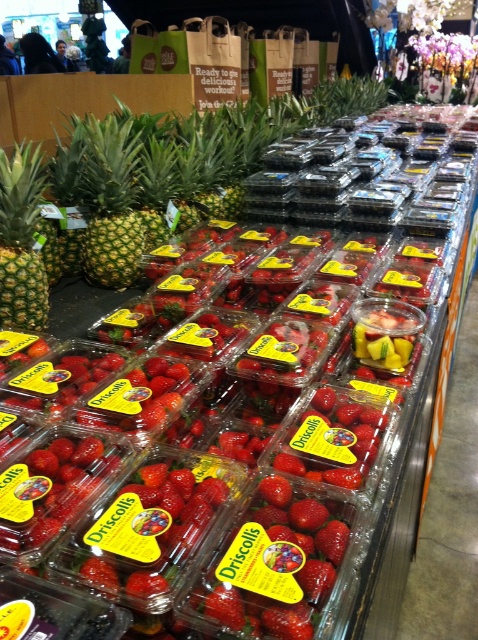
The height and width of the screenshot is (640, 478). I want to click on green matte pineapple at left, so click(110, 204).

Is point (107, 173) positioned in front of point (13, 314)?

No, it is behind (13, 314).

The width and height of the screenshot is (478, 640). In order to click on green matte pineapple at left in this screenshot , I will do `click(110, 204)`.